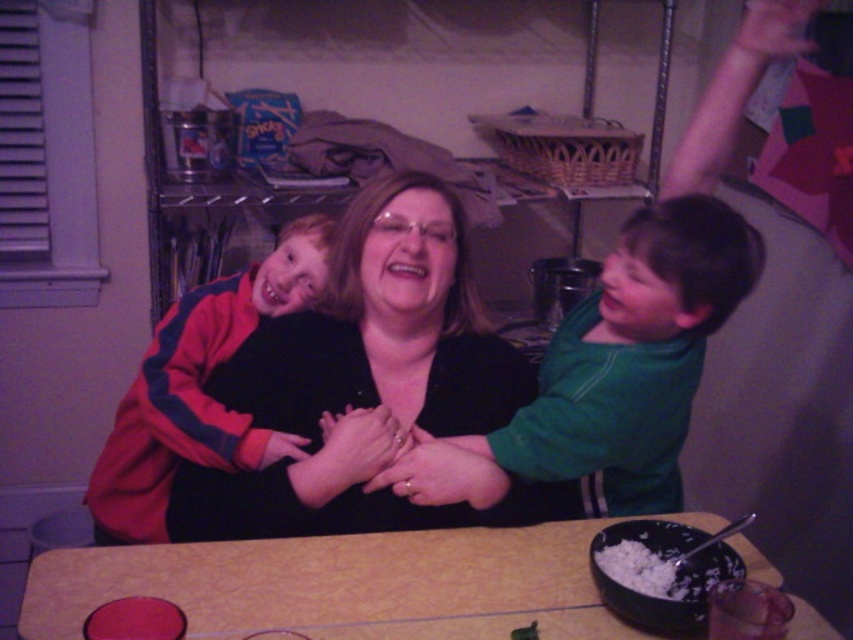
Question: Which point appears closest to the camera in this image?

Choices:
 (A) (430, 278)
 (B) (519, 545)
 (C) (225, 285)
 (D) (654, 541)

Answer: (D)

Question: Which is farther from the black matte sweater at center?

Choices:
 (A) red fleece jacket at left
 (B) green matte shirt at center

Answer: (B)

Question: Does red fleece jacket at left lie behind white matte rice bowl at lower center?

Choices:
 (A) no
 (B) yes

Answer: (B)

Question: Is yellow textured table at center bigger than white matte rice bowl at lower center?

Choices:
 (A) no
 (B) yes

Answer: (B)

Question: Based on their relative distances, which object is nearer to the green matte shirt at center?

Choices:
 (A) black matte sweater at center
 (B) yellow textured table at center

Answer: (A)

Question: Can you confirm if green matte shirt at center is positioned to the left of red fleece jacket at left?

Choices:
 (A) no
 (B) yes

Answer: (A)